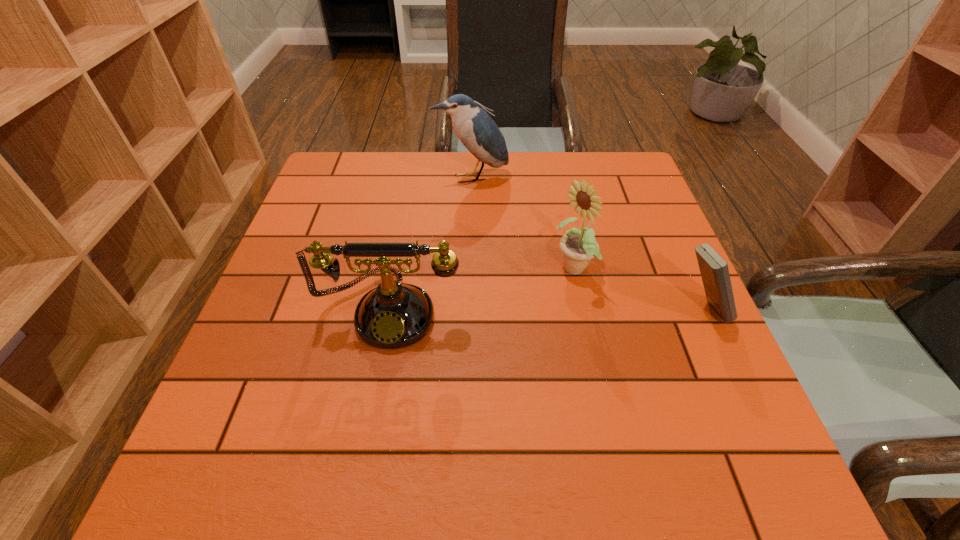
Image resolution: width=960 pixels, height=540 pixels. I want to click on free spot on the desktop that is between the third tallest object and the shortest object and is positioned on the front-facing side of the third object from left to right, so click(502, 310).

You are a GUI agent. You are given a task and a screenshot of the screen. Output one action in this format:
    pyautogui.click(x=<x>, y=<y>)
    Task: Click on the vacant spot on the desktop that is between the third tallest object and the calculator and is positioned at the tip of the bird's beak
    Image resolution: width=960 pixels, height=540 pixels.
    Given the screenshot: What is the action you would take?
    pyautogui.click(x=523, y=310)